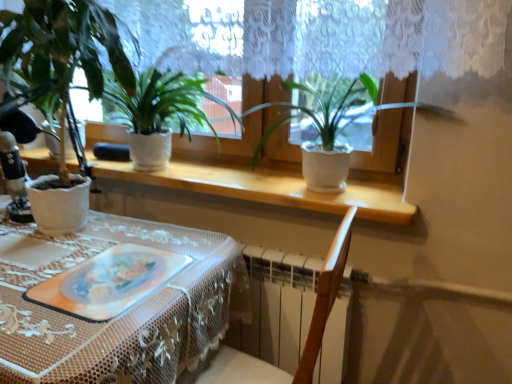
You are a GUI agent. You are given a task and a screenshot of the screen. Output one action in this format:
    pyautogui.click(x=<x>, y=<y>)
    Task: Click on the vacant area located to the right-hand side of translucent plastic platter at center
    The image size is (512, 384).
    Given the screenshot: What is the action you would take?
    pyautogui.click(x=189, y=275)